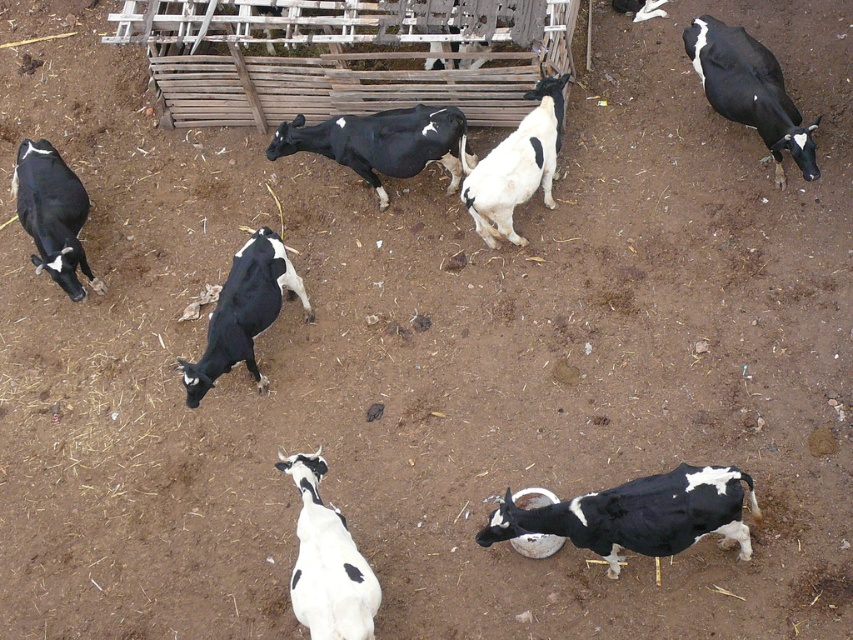
Can you confirm if black glossy cow at center is bigger than black and white spotted cow at center?

No.

Who is shorter, black glossy cow at center or black and white spotted cow at center?

Standing shorter between the two is black glossy cow at center.

Locate an element on the screen. This screenshot has height=640, width=853. black glossy cow at center is located at coordinates 383,141.

Can you confirm if black and white spotted cow at center is positioned above white woolen goat at center?

No.

The image size is (853, 640). I want to click on black and white spotted cow at center, so click(244, 312).

Does black glossy cow at center have a greater height compared to white woolen goat at center?

Incorrect, black glossy cow at center's height is not larger of white woolen goat at center's.

Who is more forward, (328, 147) or (479, 186)?

Point (479, 186)

What are the coordinates of `black glossy cow at center` in the screenshot? It's located at (383, 141).